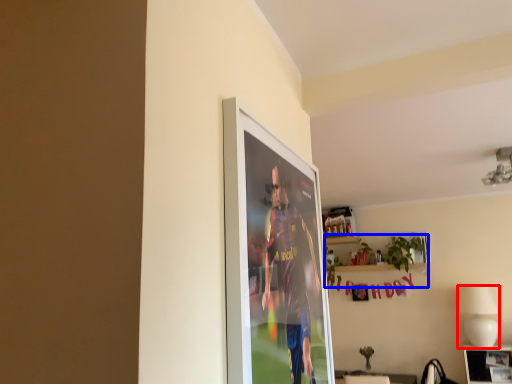
Question: Which of the following is the farthest to the observer, lamp (highlighted by a red box) or houseplant (highlighted by a blue box)?

Choices:
 (A) lamp
 (B) houseplant

Answer: (B)